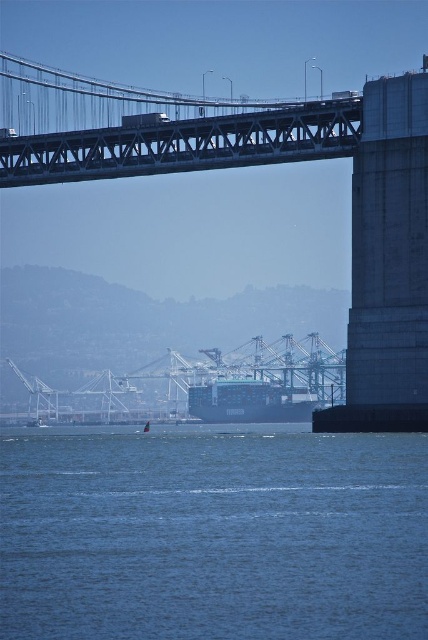
You are a drone operator tasked with capturing aerial footage of the metallic gray bridge at center and the blue matte cargo ship at center. From your current position, which object should you adjust your drone to focus on first to ensure both are in frame without moving the drone?

The metallic gray bridge at center is located above the blue matte cargo ship at center, so you should focus on the metallic gray bridge at center first to ensure both are in frame without moving the drone.